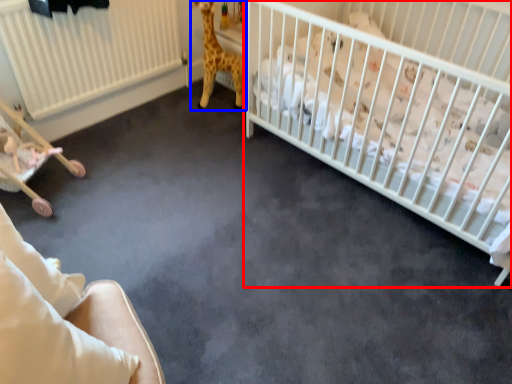
Question: Which of the following is the closest to the observer, infant bed (highlighted by a red box) or giraffe (highlighted by a blue box)?

Choices:
 (A) infant bed
 (B) giraffe

Answer: (A)